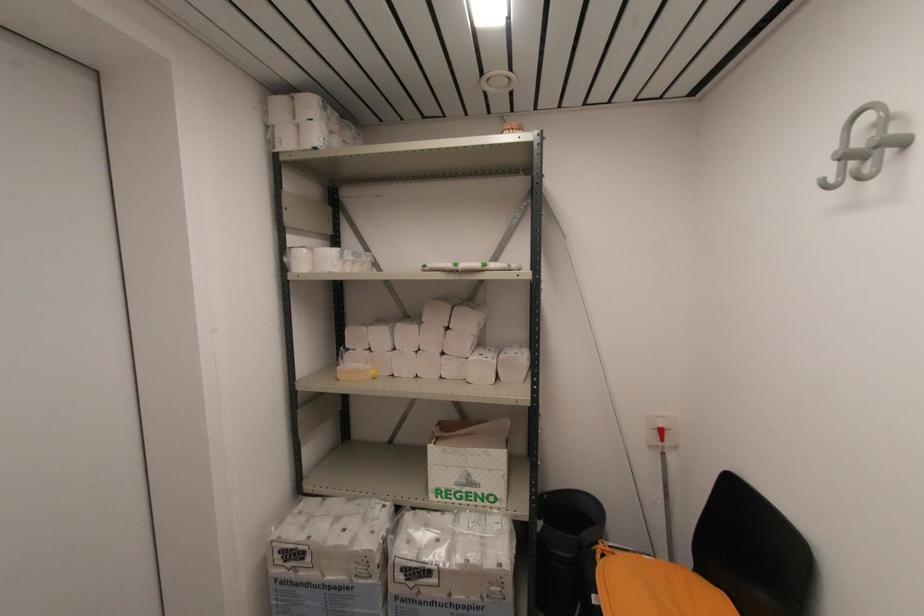
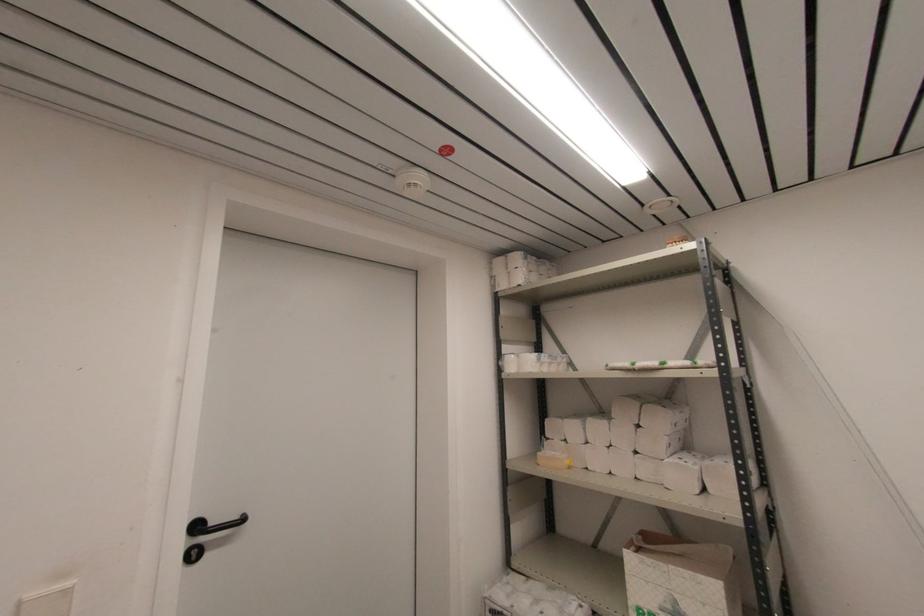
Find the pixel in the second image that matches pixel 347 347 in the first image.

(548, 436)